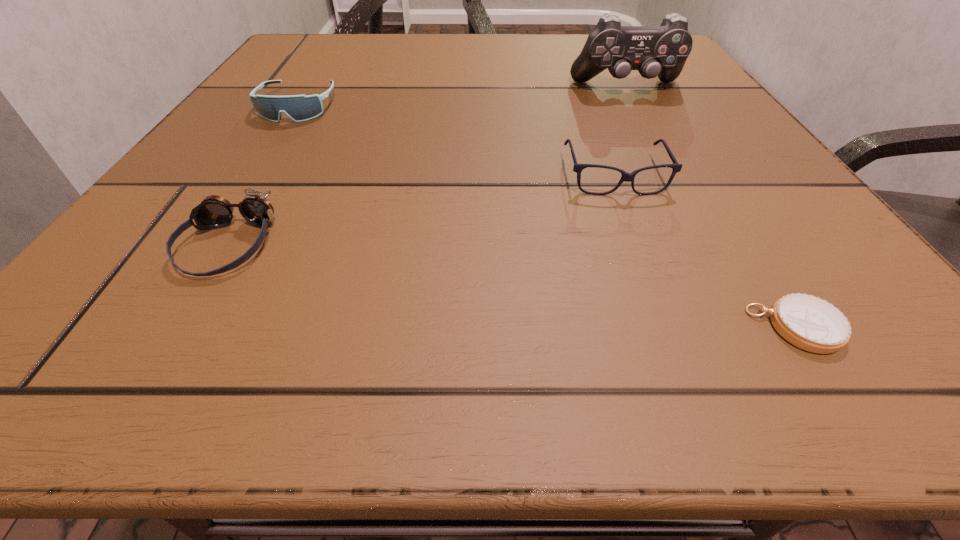
Identify the location of the tallest object. This screenshot has height=540, width=960. (662, 51).

Find the location of a particular element. The image size is (960, 540). the farther goggles is located at coordinates (300, 108).

Find the location of a particular element. the third farthest object is located at coordinates (627, 177).

Identify the location of the nearer goggles. The height and width of the screenshot is (540, 960). (214, 211).

In order to click on the shortest object in this screenshot , I will do `click(812, 324)`.

Locate an element on the screen. the nearest object is located at coordinates (812, 324).

I want to click on blank space located on the surface of the control with buttons, so click(662, 155).

I want to click on vacant space situated 0.290m on the front-facing side of the farther goggles, so click(211, 242).

In order to click on vacant point located 0.210m on the front-facing side of the third farthest object in this screenshot , I will do `click(672, 327)`.

Where is `free spot located 0.050m through the lenses of the nearer goggles`? free spot located 0.050m through the lenses of the nearer goggles is located at coordinates (183, 318).